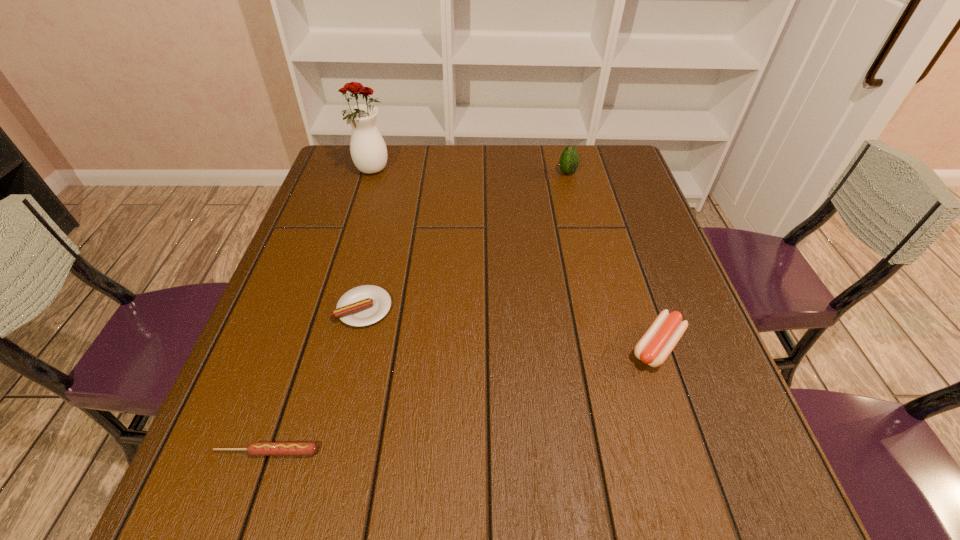
At what (x,y) coordinates should I click in order to perform the action: click on free space between the tallest object and the fourth object from left to right. Please return your answer as a coordinate pair (x, y). Looking at the image, I should click on (470, 172).

Image resolution: width=960 pixels, height=540 pixels. Find the location of `unoccupied area between the tallest object and the nearest sausage`. unoccupied area between the tallest object and the nearest sausage is located at coordinates (320, 312).

Choose which object is the second nearest neighbor to the rightmost sausage. Please provide its 2D coordinates. Your answer should be formatted as a tuple, i.e. [(x, y)], where the tuple contains the x and y coordinates of a point satisfying the conditions above.

[(569, 161)]

Where is `the second closest object to the fourth object from left to right`? the second closest object to the fourth object from left to right is located at coordinates (657, 343).

Find the location of `sausage that stands as the second closest to the shortest sausage`. sausage that stands as the second closest to the shortest sausage is located at coordinates (657, 343).

Identify which sausage is the closest to the second tallest sausage. Please provide its 2D coordinates. Your answer should be formatted as a tuple, i.e. [(x, y)], where the tuple contains the x and y coordinates of a point satisfying the conditions above.

[(256, 448)]

The height and width of the screenshot is (540, 960). Find the location of `vacant space that satisfies the following two spatial constraints: 1. on the front side of the tallest object; 2. on the left side of the second shortest sausage`. vacant space that satisfies the following two spatial constraints: 1. on the front side of the tallest object; 2. on the left side of the second shortest sausage is located at coordinates (330, 308).

This screenshot has width=960, height=540. What are the coordinates of `free space that satisfies the following two spatial constraints: 1. on the back side of the nearest object; 2. on the left side of the second tallest sausage` in the screenshot? It's located at (316, 308).

Identify the location of vacant area in the image that satisfies the following two spatial constraints: 1. on the front side of the second tallest object; 2. on the right side of the third tallest object. (611, 346).

The height and width of the screenshot is (540, 960). I want to click on free space that satisfies the following two spatial constraints: 1. on the front side of the vase; 2. on the left side of the fourth shortest object, so point(372,173).